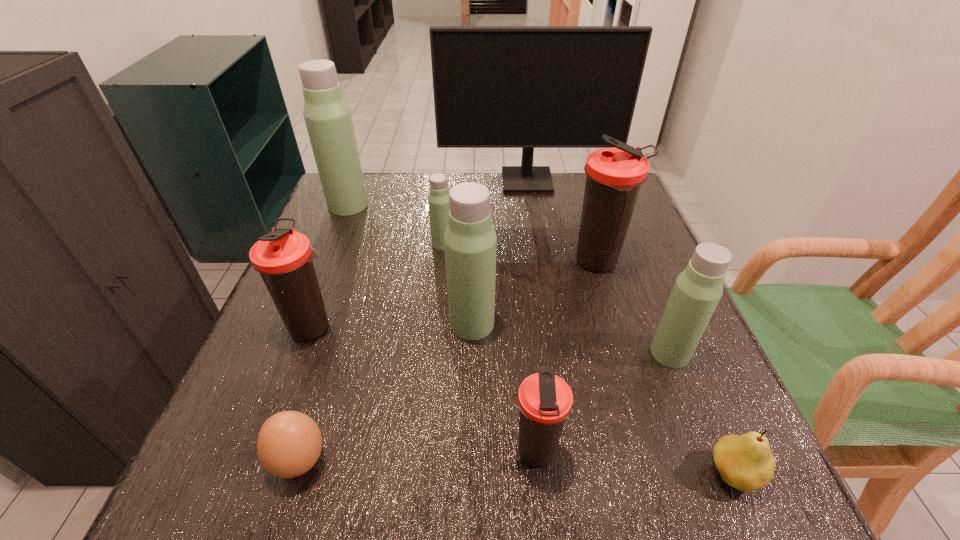
Locate an element on the screen. This screenshot has height=540, width=960. computer monitor is located at coordinates (527, 87).

What are the coordinates of `the biggest light thermos bottle` in the screenshot? It's located at (327, 116).

The width and height of the screenshot is (960, 540). In order to click on the farthest light thermos bottle in this screenshot , I will do `click(327, 116)`.

Identify the location of the rightmost brown thermos bottle. The image size is (960, 540). click(614, 177).

What are the coordinates of `the biggest brown thermos bottle` in the screenshot? It's located at (614, 177).

Find the location of `the second biggest light thermos bottle`. the second biggest light thermos bottle is located at coordinates (470, 241).

The image size is (960, 540). Identify the location of the fourth thermos bottle from left to right. (470, 241).

Locate an element on the screen. Image resolution: width=960 pixels, height=540 pixels. the second biggest brown thermos bottle is located at coordinates click(x=283, y=257).

Locate an element on the screen. The width and height of the screenshot is (960, 540). the second farthest brown thermos bottle is located at coordinates (283, 257).

Where is `the second smallest light thermos bottle`? the second smallest light thermos bottle is located at coordinates (697, 290).